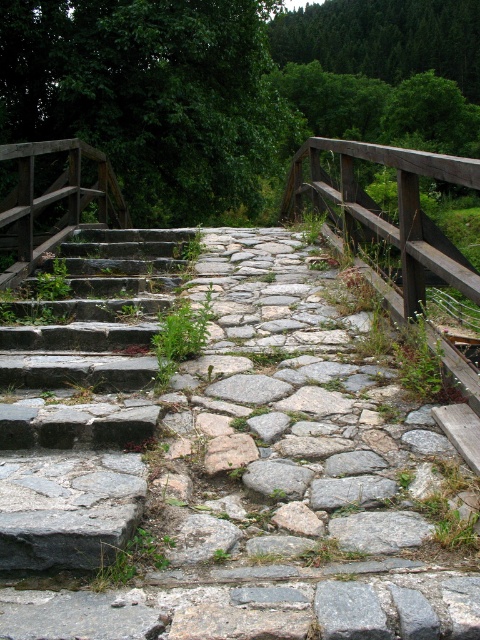
Question: Does gray stone path at center have a lesser width compared to rusty stone stairs at left?

Choices:
 (A) no
 (B) yes

Answer: (A)

Question: Among these points, which one is nearest to the camera?

Choices:
 (A) (405, 250)
 (B) (142, 294)
 (C) (289, 481)

Answer: (C)

Question: Which is farther from the gray rough stone at center?

Choices:
 (A) gray stone path at center
 (B) rusty stone stairs at left

Answer: (B)

Question: Estimate the real-world distances between objects in this image. Which object is closer to the rusty stone stairs at left?

Choices:
 (A) gray stone path at center
 (B) gray rough stone at center
 (C) wooden planks at left
 (D) wooden rail at center

Answer: (A)

Question: Does wooden rail at center have a smaller size compared to gray rough stone at center?

Choices:
 (A) no
 (B) yes

Answer: (A)

Question: Is wooden planks at left positioned behind gray rough stone at center?

Choices:
 (A) no
 (B) yes

Answer: (B)